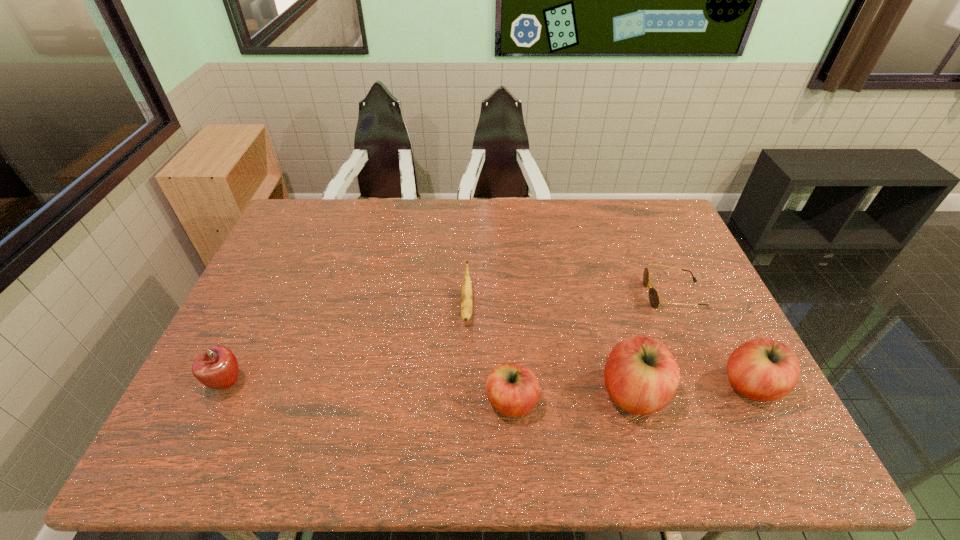
The apples are evenly distributed in the image. To maintain this, where would you place another apple on the left? Please point to a free space. Please provide its 2D coordinates. Your answer should be formatted as a tuple, i.e. [(x, y)], where the tuple contains the x and y coordinates of a point satisfying the conditions above.

[(386, 410)]